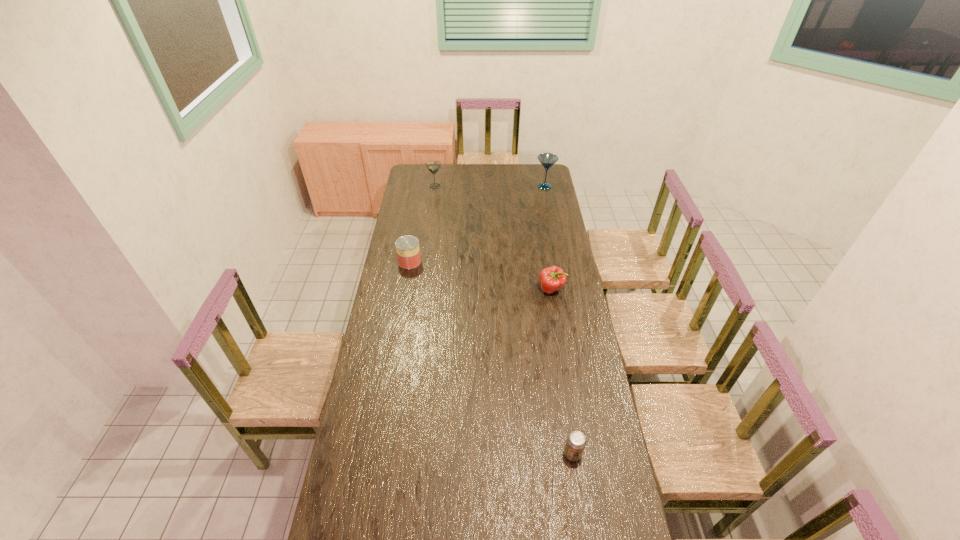
The height and width of the screenshot is (540, 960). Find the location of `the right martini`. the right martini is located at coordinates (547, 160).

The height and width of the screenshot is (540, 960). I want to click on the left martini, so click(x=433, y=166).

Find the location of a particular element. The image size is (960, 540). the second tallest object is located at coordinates (433, 166).

At what (x,y) coordinates should I click in order to perform the action: click on the fourth farthest object. Please return your answer as a coordinate pair (x, y). Looking at the image, I should click on (552, 279).

Where is `can`? can is located at coordinates (407, 247).

Find the location of a particular element. This screenshot has height=540, width=960. the nearest object is located at coordinates (576, 441).

Where is `free space located 0.330m on the left of the right martini`? The width and height of the screenshot is (960, 540). free space located 0.330m on the left of the right martini is located at coordinates (482, 186).

Image resolution: width=960 pixels, height=540 pixels. In order to click on free point located on the right of the left martini in this screenshot , I will do pyautogui.click(x=474, y=186).

Locate an element on the screen. This screenshot has width=960, height=540. blank space located 0.260m on the back of the pepper is located at coordinates (544, 245).

You are a GUI agent. You are given a task and a screenshot of the screen. Output one action in this format:
    pyautogui.click(x=<x>, y=<y>)
    Task: Click on the free space located 0.100m on the right of the third farthest object
    Image resolution: width=960 pixels, height=540 pixels.
    Given the screenshot: What is the action you would take?
    pyautogui.click(x=441, y=261)